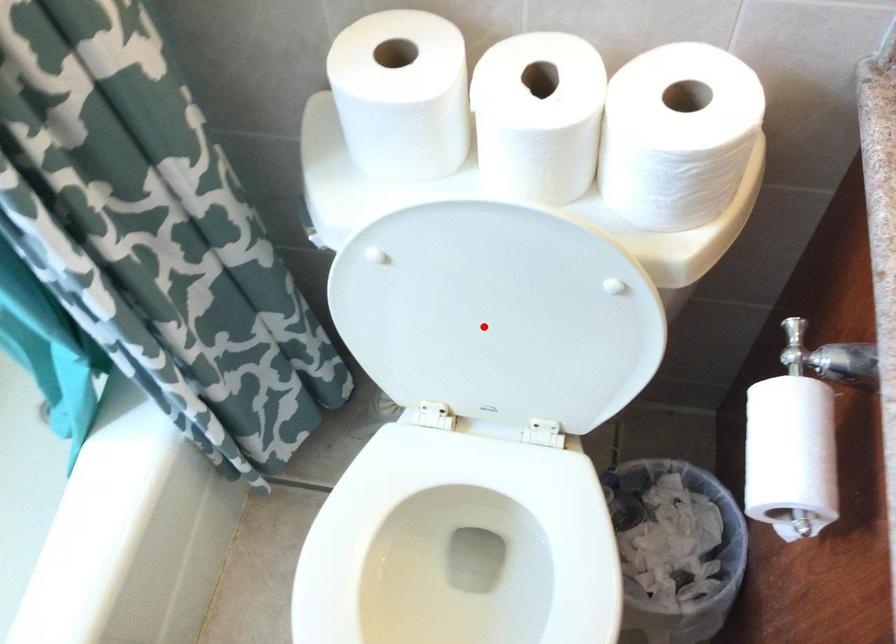
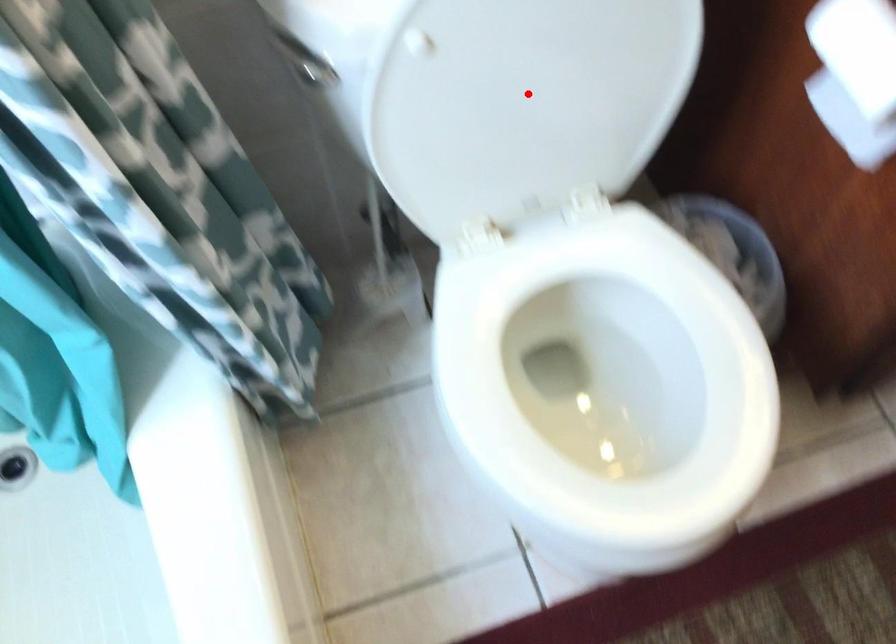
I am providing you with two images of the same scene from different viewpoints. A red point is marked on the first image and another point is marked on the second image. Is the red point in image1 aligned with the point shown in image2?

Yes